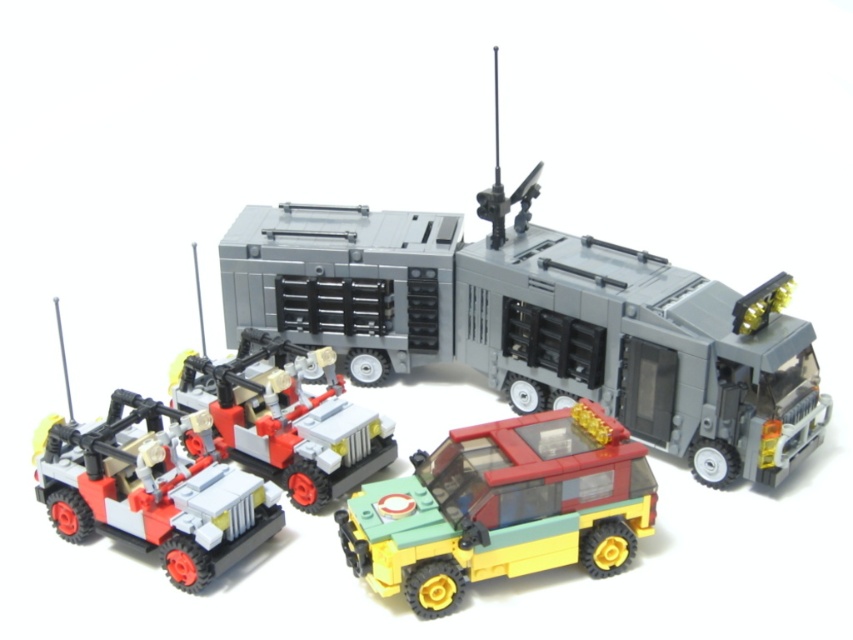
Is matte gray truck at center positioned at the back of brick-like red and white vehicle at center-left?

No.

Can you confirm if matte gray truck at center is smaller than brick-like red and white vehicle at center-left?

No, matte gray truck at center is not smaller than brick-like red and white vehicle at center-left.

Between point (599, 316) and point (236, 358), which one is positioned in front?

Point (599, 316) is more forward.

Find the location of `matte gray truck at center`. matte gray truck at center is located at coordinates click(x=538, y=321).

Can you confirm if matte gray truck at center is wider than matte red and white vehicle at lower left?

Yes.

Can you confirm if matte gray truck at center is positioned to the left of matte red and white vehicle at lower left?

Incorrect, matte gray truck at center is not on the left side of matte red and white vehicle at lower left.

Where is `matte gray truck at center`? matte gray truck at center is located at coordinates (538, 321).

Which is behind, point (151, 516) or point (334, 380)?

The point (334, 380) is behind.

At what (x,y) coordinates should I click in order to perform the action: click on matte red and white vehicle at lower left. Please return your answer as a coordinate pair (x, y). The height and width of the screenshot is (640, 853). Looking at the image, I should click on (151, 484).